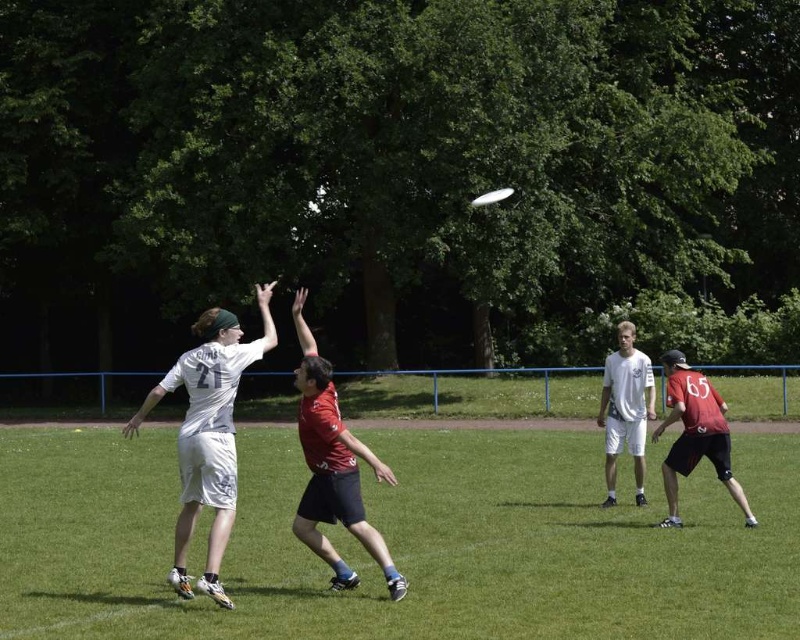
You are a player in the ultimate frisbee game. You need to position yourself at the point with coordinates (x=696, y=435) to intercept the frisbee. According to the scene description, what object is located at that specific coordinate?

The point at coordinates (x=696, y=435) is occupied by the red matte jersey at center.

You are a photographer standing at the edge of the field. You want to capture a photo where the white matte shorts at center is visible above the green grass at center. Based on the scene, is this possible?

The green grass at center is below white matte shorts at center, so yes, the white matte shorts at center will be visible above the green grass at center in the photo.

You are standing at the camera position and want to throw a frisbee to a friend who is standing at point (718, 529). The frisbee can travel up to 40 feet. Will it reach your friend?

The distance of point (718, 529) from camera is 37.63 feet, so yes, the frisbee can reach your friend since it is within the 40 feet range.